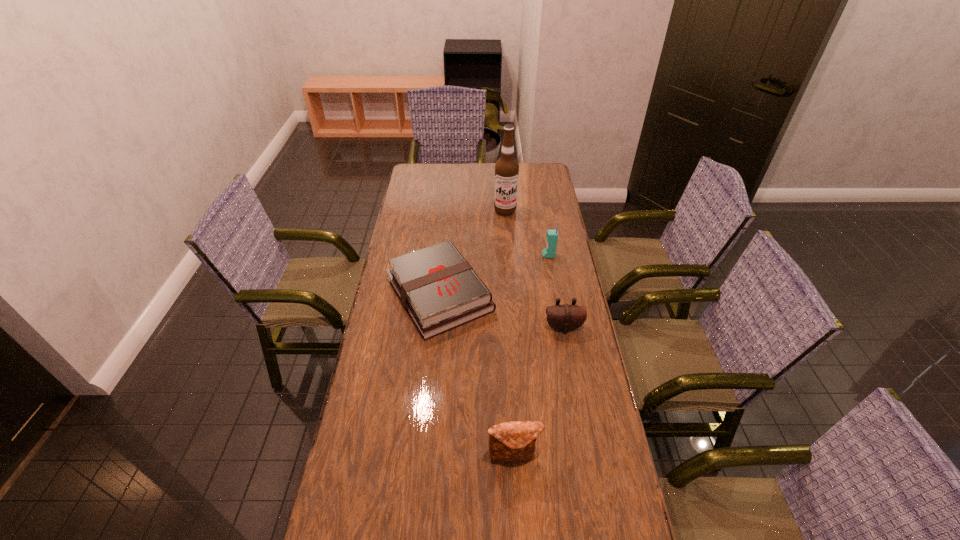
Where is `free spot between the shortest object and the second shortest object`? free spot between the shortest object and the second shortest object is located at coordinates (501, 311).

Locate which object ranks second in proximity to the clutch bag. Please provide its 2D coordinates. Your answer should be formatted as a tuple, i.e. [(x, y)], where the tuple contains the x and y coordinates of a point satisfying the conditions above.

[(564, 318)]

Locate an element on the screen. Image resolution: width=960 pixels, height=540 pixels. object identified as the closest to the fourth tallest object is located at coordinates (438, 288).